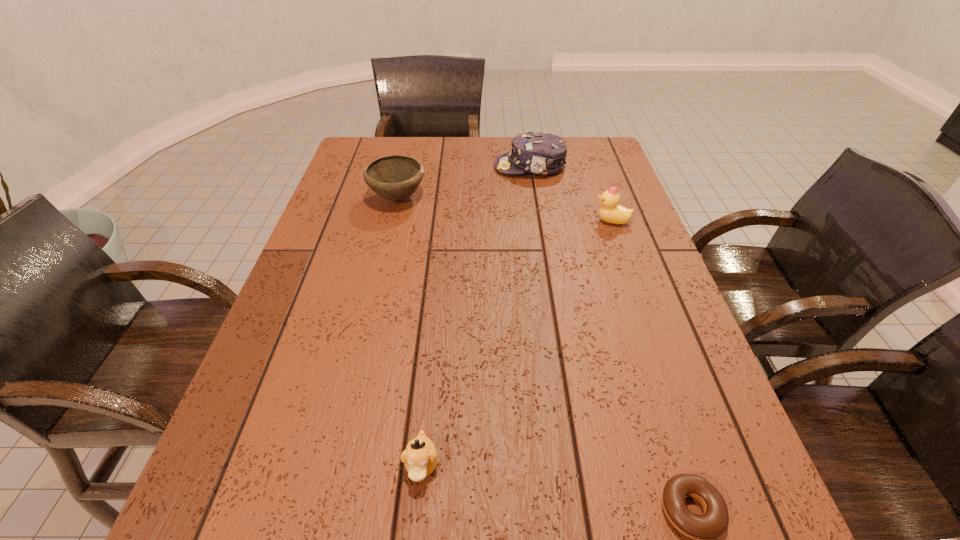
This screenshot has width=960, height=540. In order to click on vacant space at the left edge in this screenshot , I will do `click(352, 294)`.

The image size is (960, 540). What are the coordinates of `free space at the right edge of the desktop` in the screenshot? It's located at (639, 224).

This screenshot has width=960, height=540. In order to click on free area in between the bowl and the farther duckling in this screenshot , I will do `click(505, 210)`.

Where is `vacant area that lies between the right duckling and the third object from left to right`? vacant area that lies between the right duckling and the third object from left to right is located at coordinates (571, 194).

Where is `vacant area between the fourth object from right to left and the farther duckling`? vacant area between the fourth object from right to left and the farther duckling is located at coordinates (516, 343).

Image resolution: width=960 pixels, height=540 pixels. Identify the location of free space between the nearer duckling and the leftmost object. pos(410,332).

Where is `vacant space that is in between the nearer duckling and the bowl`? The image size is (960, 540). vacant space that is in between the nearer duckling and the bowl is located at coordinates (410, 332).

Identify the location of vacant area that lies between the bowl and the fourth object from right to left. Image resolution: width=960 pixels, height=540 pixels. (410, 332).

Locate an element on the screen. vacant point located between the leftmost object and the farthest object is located at coordinates (464, 183).

At what (x,y) coordinates should I click in order to perform the action: click on free space between the fourth tallest object and the third object from left to right. Please return your answer as a coordinate pair (x, y). This screenshot has width=960, height=540. Looking at the image, I should click on (476, 316).